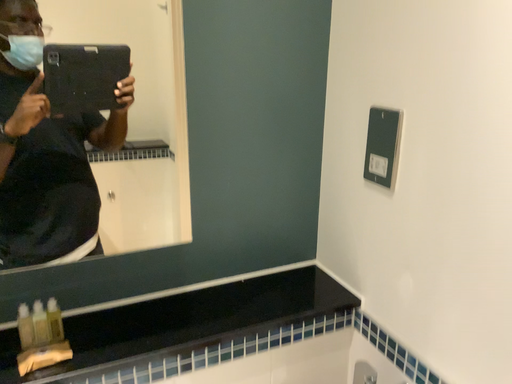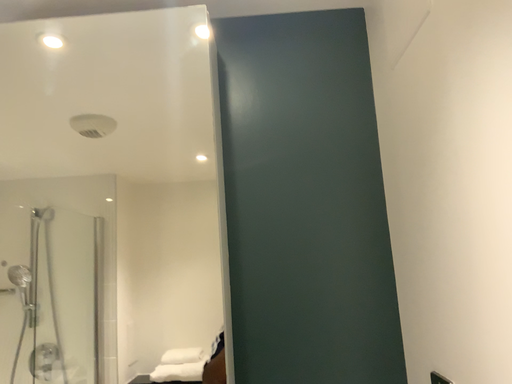
Question: Which way did the camera rotate in the video?

Choices:
 (A) rotated left
 (B) rotated right

Answer: (A)